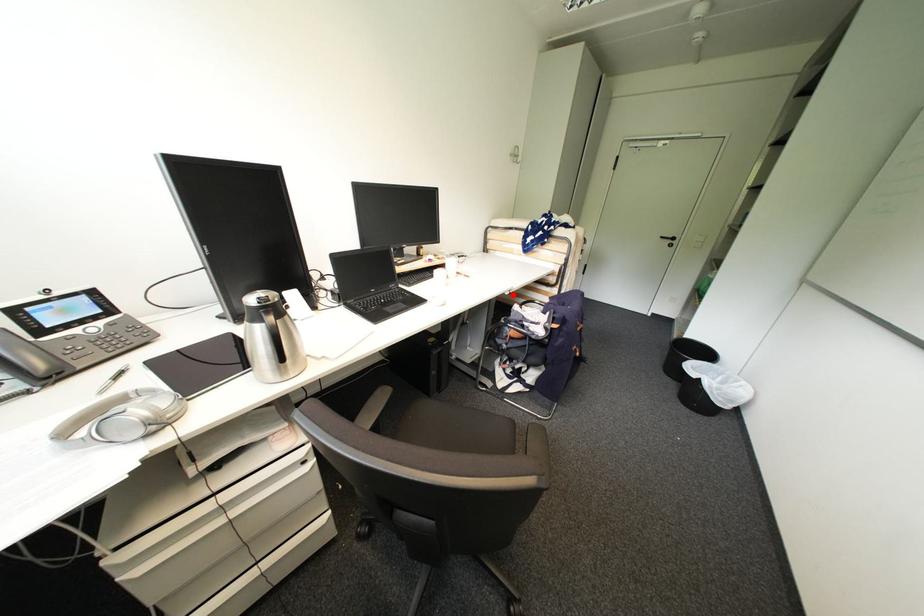
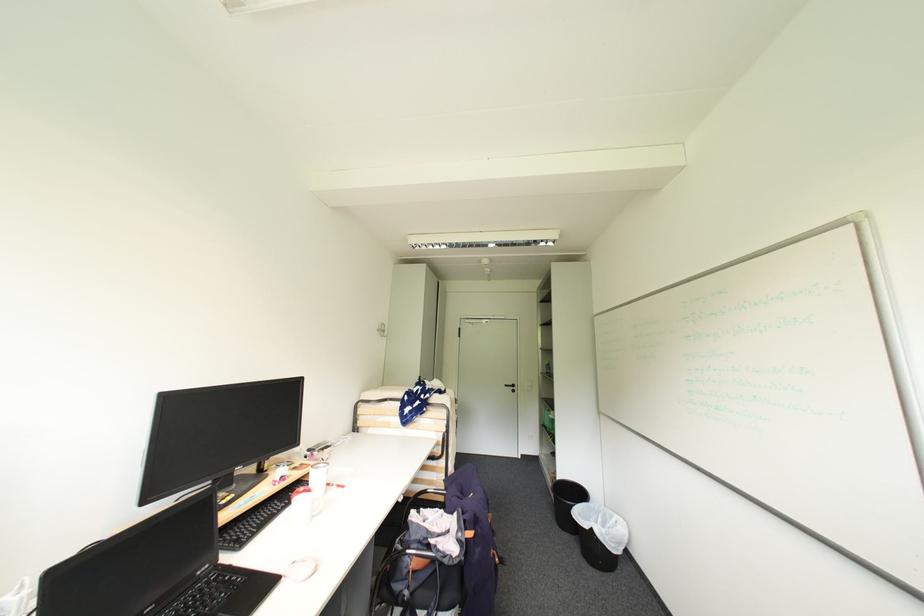
Question: I am providing you with two images of the same scene from different viewpoints. In image1, a red point is highlighted. Considering the same 3D point in image2, which of the following is correct?

Choices:
 (A) It is closer
 (B) It is farther

Answer: (B)